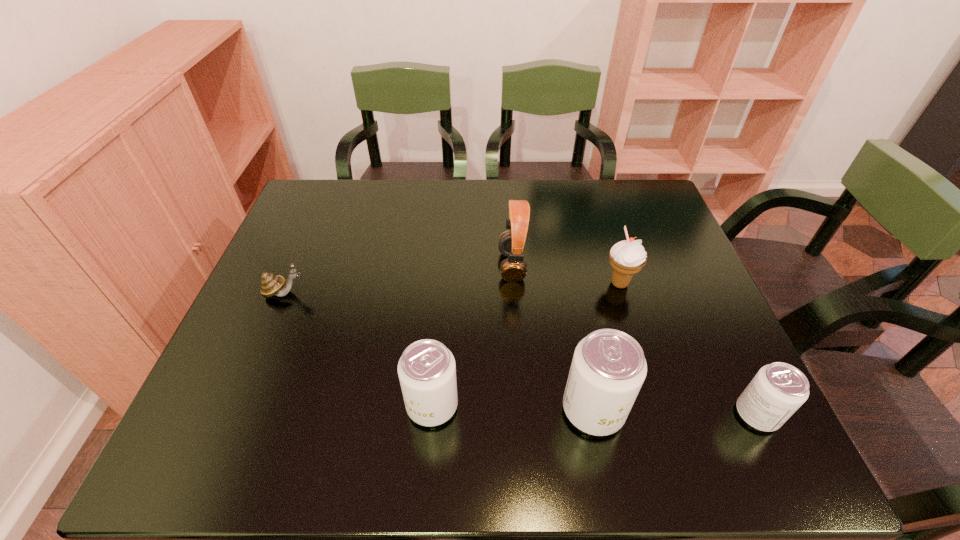
Find the location of a particular element. The height and width of the screenshot is (540, 960). free space that satisfies the following two spatial constraints: 1. on the ear cups of the third object from left to right; 2. on the left side of the icecream is located at coordinates (513, 284).

Where is `free space that satisfies the following two spatial constraints: 1. on the face of the snail; 2. on the left side of the shortest soda can`? free space that satisfies the following two spatial constraints: 1. on the face of the snail; 2. on the left side of the shortest soda can is located at coordinates (232, 414).

Image resolution: width=960 pixels, height=540 pixels. In order to click on vacant point that satisfies the following two spatial constraints: 1. on the ear cups of the third object from left to right; 2. on the front side of the second object from left to right in this screenshot , I will do click(x=522, y=405).

I want to click on free location that satisfies the following two spatial constraints: 1. on the ear cups of the fourth object from left to right; 2. on the left side of the fourth object from right to left, so click(522, 410).

At what (x,y) coordinates should I click in order to perform the action: click on vacant space that satisfies the following two spatial constraints: 1. on the ear cups of the headset; 2. on the right side of the second object from right to left. Please return your answer as a coordinate pair (x, y). Looking at the image, I should click on (513, 284).

You are a GUI agent. You are given a task and a screenshot of the screen. Output one action in this format:
    pyautogui.click(x=<x>, y=<y>)
    Task: Click on the free spot that satisfies the following two spatial constraints: 1. on the ear cups of the headset; 2. on the back side of the icecream
    
    Given the screenshot: What is the action you would take?
    pyautogui.click(x=513, y=284)